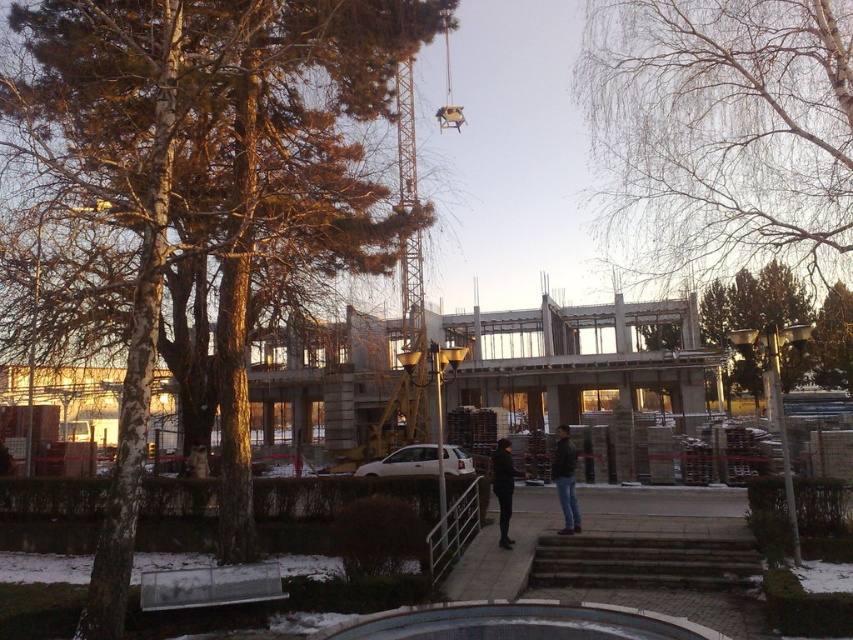
Who is more distant from viewer, (x=631, y=209) or (x=566, y=486)?

Point (x=631, y=209)

Where is `bare branches at upper center`? The width and height of the screenshot is (853, 640). bare branches at upper center is located at coordinates (721, 125).

Can you confirm if brown textured tree at upper left is taller than dark gray concrete stairs at center?

Indeed, brown textured tree at upper left has a greater height compared to dark gray concrete stairs at center.

Who is more distant from viewer, [357,186] or [569,584]?

Point [357,186]

This screenshot has width=853, height=640. I want to click on brown textured tree at upper left, so click(212, 180).

Is dark gray concrete stairs at center closer to the viewer compared to dark matte coat at center?

Yes, it is in front of dark matte coat at center.

Between point (585, 564) and point (512, 488), which one is positioned in front?

Point (585, 564) is in front.

Where is `dark gray concrete stairs at center`? Image resolution: width=853 pixels, height=640 pixels. dark gray concrete stairs at center is located at coordinates (642, 561).